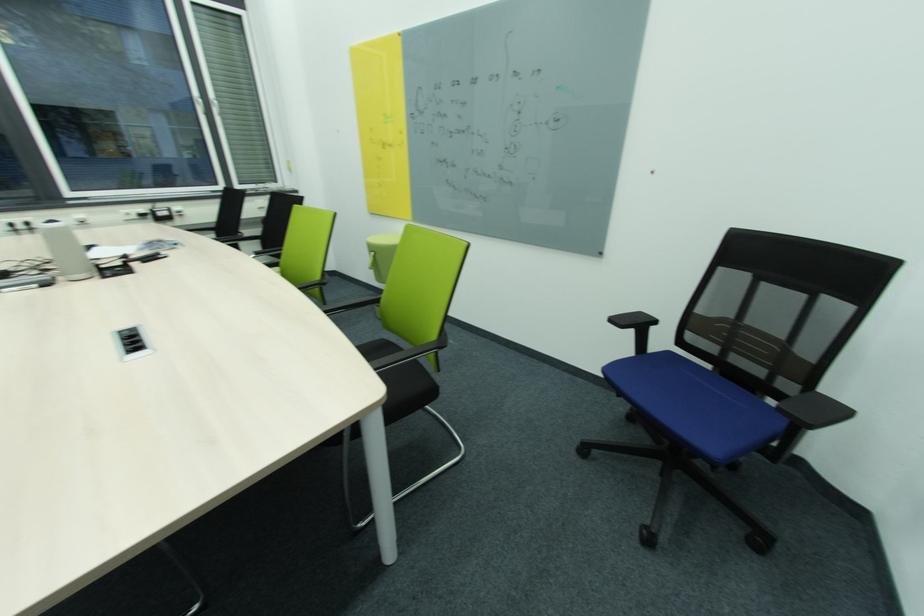
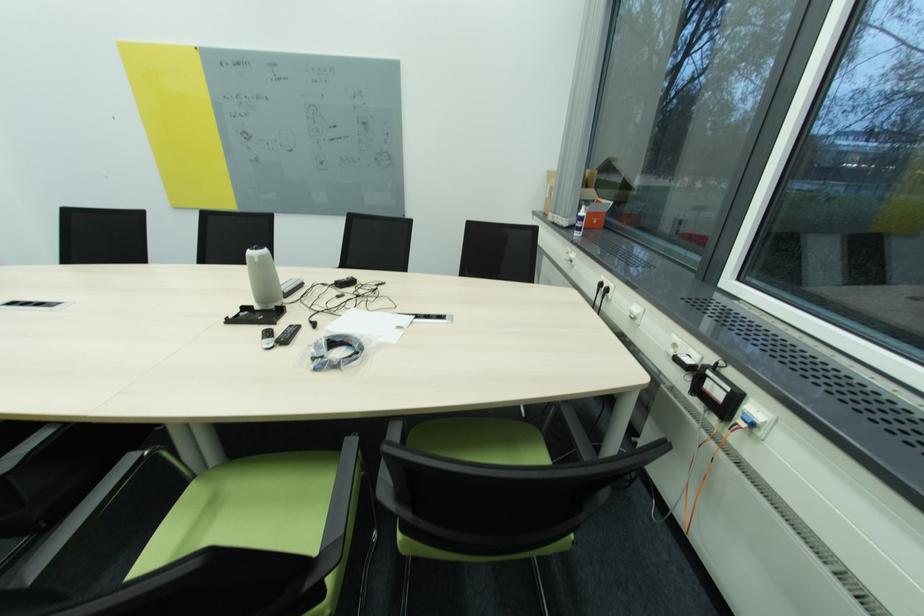
Find the pixel in the second image that matches point 131,216 in the first image.

(679, 346)